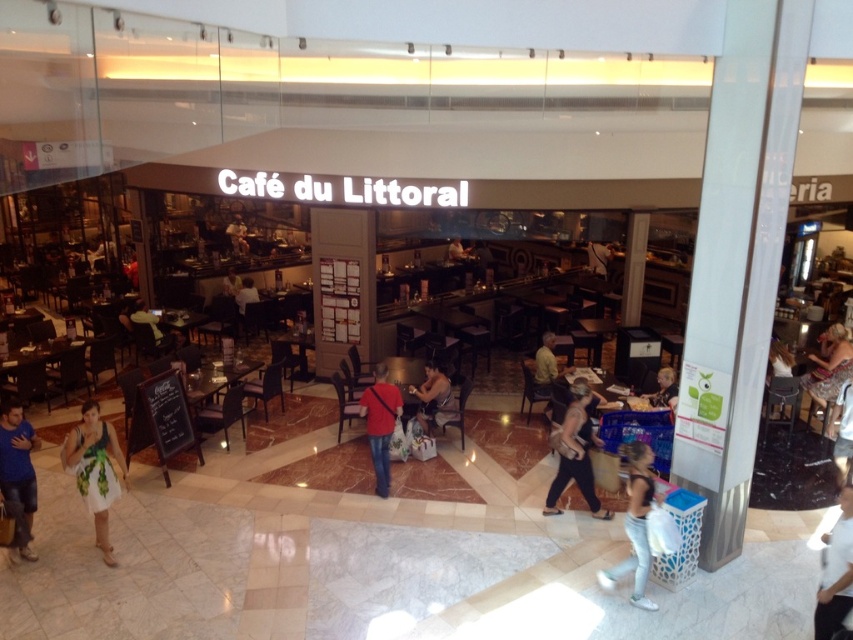
Question: Which point is closer to the camera?

Choices:
 (A) matte black laptop at center
 (B) blue denim shirt at lower left
 (C) dark gray pants at center

Answer: (B)

Question: From the image, what is the correct spatial relationship of matte black laptop at center in relation to matte black shirt at center?

Choices:
 (A) below
 (B) above

Answer: (A)

Question: Is white floral dress at lower left thinner than matte black jacket at center?

Choices:
 (A) yes
 (B) no

Answer: (B)

Question: Does dark gray pants at center have a greater width compared to brown leather jacket at center?

Choices:
 (A) no
 (B) yes

Answer: (B)

Question: Estimate the real-world distances between objects in this image. Which object is closer to the brown leather jacket at center?

Choices:
 (A) blue denim shirt at lower left
 (B) white cotton shirt at lower right
 (C) matte black jacket at center

Answer: (C)

Question: Which object appears farthest from the camera in this image?

Choices:
 (A) matte red shirt at center
 (B) blue denim shirt at lower left

Answer: (A)